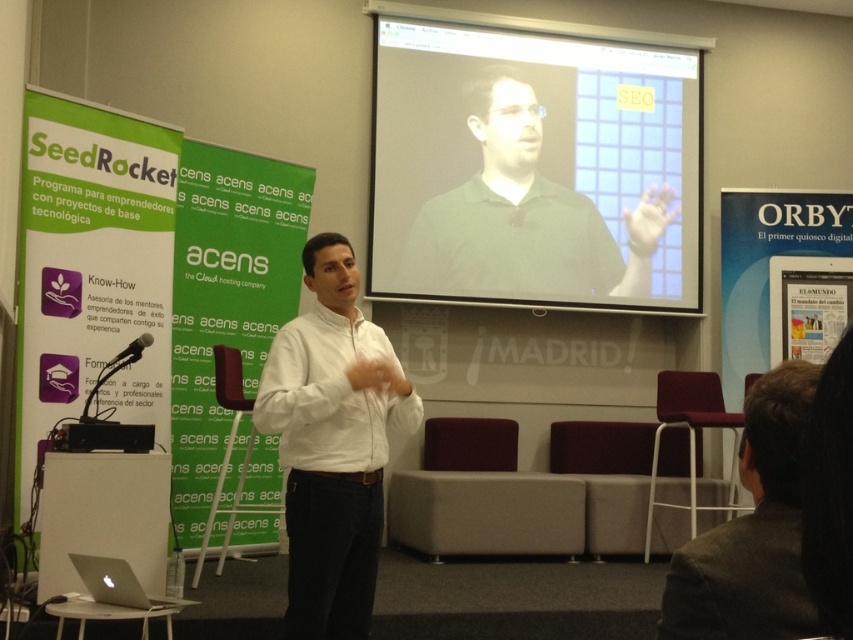
Between white matte shirt at center and silver metallic laptop at lower left, which one appears on the left side from the viewer's perspective?

silver metallic laptop at lower left

Measure the distance between white matte shirt at center and silver metallic laptop at lower left.

white matte shirt at center and silver metallic laptop at lower left are 31.18 inches apart.

Is point (315, 515) more distant than point (91, 580)?

No, (315, 515) is closer to viewer.

At what (x,y) coordinates should I click in order to perform the action: click on white matte shirt at center. Please return your answer as a coordinate pair (x, y). Looking at the image, I should click on (332, 444).

Does matte black projector screen at upper center lie behind white matte shirt at center?

That is True.

Describe the element at coordinates (534, 163) in the screenshot. I see `matte black projector screen at upper center` at that location.

You are a GUI agent. You are given a task and a screenshot of the screen. Output one action in this format:
    pyautogui.click(x=<x>, y=<y>)
    Task: Click on the matte black projector screen at upper center
    The image size is (853, 640).
    Given the screenshot: What is the action you would take?
    pyautogui.click(x=534, y=163)

Does matte black projector screen at upper center come behind dark brown hair at lower right?

That is True.

Which is more to the left, matte black projector screen at upper center or dark brown hair at lower right?

From the viewer's perspective, dark brown hair at lower right appears more on the left side.

Where is `matte black projector screen at upper center`? This screenshot has height=640, width=853. matte black projector screen at upper center is located at coordinates (534, 163).